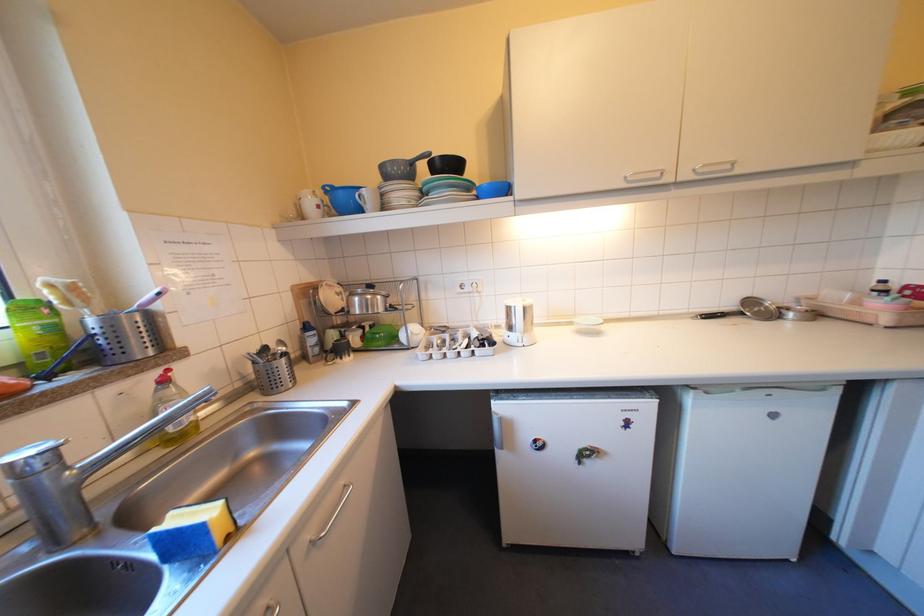
Locate an element on the screen. This screenshot has height=616, width=924. refrigerator door handle is located at coordinates (496, 431).